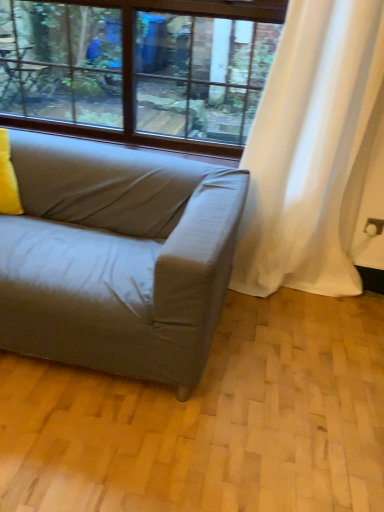
Question: From the image's perspective, would you say yellow fabric pillow at left is positioned over white sheer curtain at right?

Choices:
 (A) no
 (B) yes

Answer: (A)

Question: Would you say yellow fabric pillow at left is outside white sheer curtain at right?

Choices:
 (A) no
 (B) yes

Answer: (B)

Question: Does yellow fabric pillow at left have a larger size compared to white sheer curtain at right?

Choices:
 (A) yes
 (B) no

Answer: (B)

Question: Can you confirm if yellow fabric pillow at left is shorter than white sheer curtain at right?

Choices:
 (A) yes
 (B) no

Answer: (A)

Question: Is yellow fabric pillow at left surrounding white sheer curtain at right?

Choices:
 (A) no
 (B) yes

Answer: (A)

Question: Is point (311, 27) closer or farther from the camera than point (18, 212)?

Choices:
 (A) farther
 (B) closer

Answer: (B)

Question: Considering the positions of white sheer curtain at right and yellow fabric pillow at left in the image, is white sheer curtain at right bigger or smaller than yellow fabric pillow at left?

Choices:
 (A) big
 (B) small

Answer: (A)

Question: From a real-world perspective, is white sheer curtain at right positioned above or below yellow fabric pillow at left?

Choices:
 (A) above
 (B) below

Answer: (A)

Question: Considering the positions of white sheer curtain at right and yellow fabric pillow at left in the image, is white sheer curtain at right wider or thinner than yellow fabric pillow at left?

Choices:
 (A) wide
 (B) thin

Answer: (B)

Question: Considering the positions of white sheer curtain at right and clear glass window at upper center in the image, is white sheer curtain at right wider or thinner than clear glass window at upper center?

Choices:
 (A) thin
 (B) wide

Answer: (B)

Question: Is white sheer curtain at right inside or outside of clear glass window at upper center?

Choices:
 (A) outside
 (B) inside

Answer: (A)

Question: Is point (263, 92) closer or farther from the camera than point (125, 5)?

Choices:
 (A) closer
 (B) farther

Answer: (A)

Question: From their relative heights in the image, would you say white sheer curtain at right is taller or shorter than clear glass window at upper center?

Choices:
 (A) tall
 (B) short

Answer: (A)

Question: Based on their sizes in the image, would you say yellow fabric pillow at left is bigger or smaller than white sheer curtain at right?

Choices:
 (A) big
 (B) small

Answer: (B)

Question: Considering the positions of point (8, 187) and point (299, 136), is point (8, 187) closer or farther from the camera than point (299, 136)?

Choices:
 (A) closer
 (B) farther

Answer: (B)